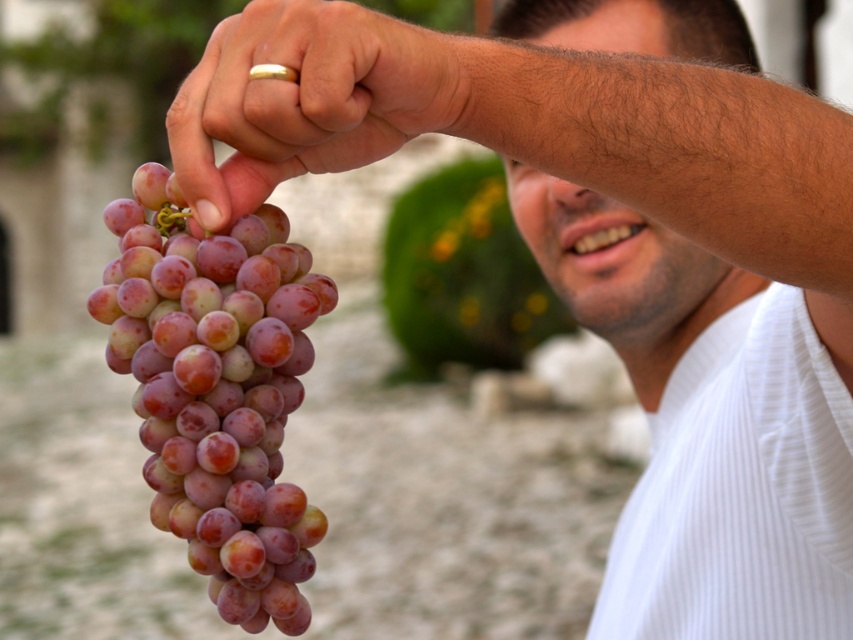
Question: Can you confirm if purple glossy grapes at left is smaller than matte gold ring at upper center?

Choices:
 (A) no
 (B) yes

Answer: (A)

Question: Does purple glossy grapes at left lie in front of matte gold ring at upper center?

Choices:
 (A) yes
 (B) no

Answer: (B)

Question: Does purple glossy grapes at left have a smaller size compared to matte gold ring at upper center?

Choices:
 (A) no
 (B) yes

Answer: (A)

Question: Which point is closer to the camera taking this photo?

Choices:
 (A) (294, 20)
 (B) (165, 257)

Answer: (A)